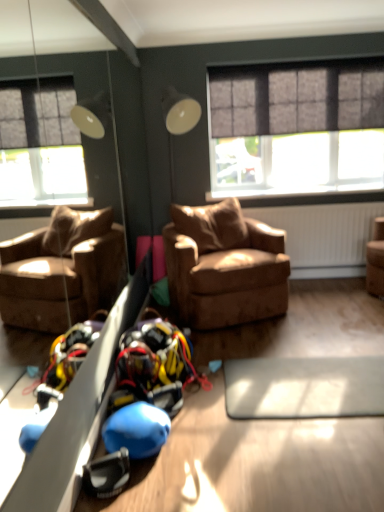
Question: Is point (319, 76) closer or farther from the camera than point (357, 138)?

Choices:
 (A) closer
 (B) farther

Answer: (A)

Question: Is dark gray textured curtain at upper center inside the boundaries of matte gray window at upper right, or outside?

Choices:
 (A) outside
 (B) inside

Answer: (A)

Question: Which is nearer to the brown leather armchair at center?

Choices:
 (A) matte gray window at upper right
 (B) dark gray textured curtain at upper center

Answer: (A)

Question: Which object is positioned closest to the brown leather armchair at center?

Choices:
 (A) matte gray window at upper right
 (B) dark gray textured curtain at upper center

Answer: (A)